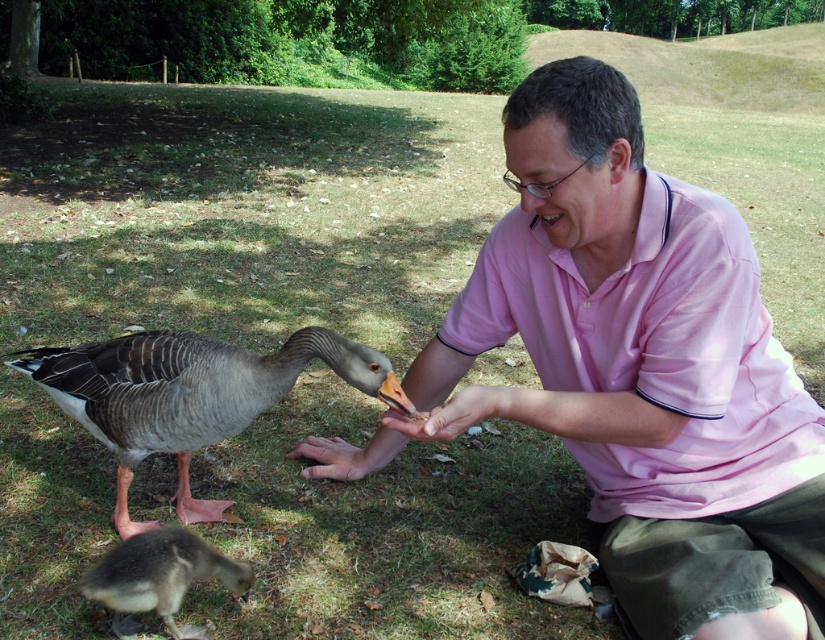
Does pink cotton polo shirt at center appear on the right side of brown leather hand at lower center?

Indeed, pink cotton polo shirt at center is positioned on the right side of brown leather hand at lower center.

Is the position of pink cotton polo shirt at center more distant than that of brown leather hand at lower center?

No, pink cotton polo shirt at center is closer to the viewer.

What do you see at coordinates (654, 353) in the screenshot? The width and height of the screenshot is (825, 640). I see `pink cotton polo shirt at center` at bounding box center [654, 353].

Where is `pink cotton polo shirt at center`? The height and width of the screenshot is (640, 825). pink cotton polo shirt at center is located at coordinates (654, 353).

Between pink cotton polo shirt at center and matte skin hand at center, which one is positioned lower?

Positioned lower is matte skin hand at center.

Based on the photo, does pink cotton polo shirt at center have a larger size compared to matte skin hand at center?

Yes.

Describe the element at coordinates (654, 353) in the screenshot. I see `pink cotton polo shirt at center` at that location.

Locate an element on the screen. This screenshot has height=640, width=825. pink cotton polo shirt at center is located at coordinates (654, 353).

Does pink cotton shirt at center lie in front of brown leather hand at lower center?

Yes.

Is pink cotton shirt at center further to the viewer compared to brown leather hand at lower center?

No, pink cotton shirt at center is in front of brown leather hand at lower center.

Is point (646, 243) closer to camera compared to point (317, 470)?

Yes.

Locate an element on the screen. pink cotton shirt at center is located at coordinates (649, 365).